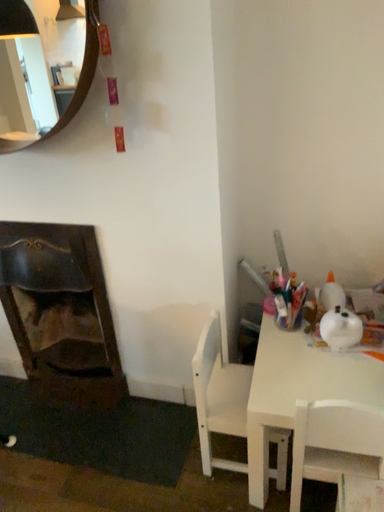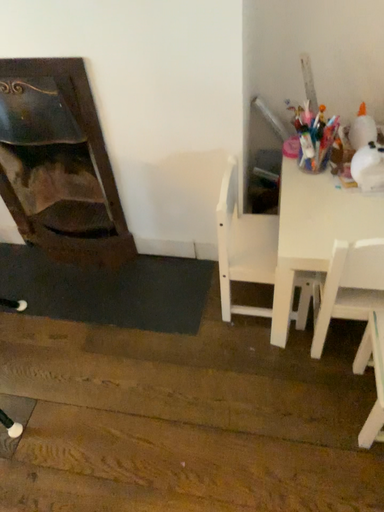
Question: How did the camera likely rotate when shooting the video?

Choices:
 (A) rotated downward
 (B) rotated upward

Answer: (A)